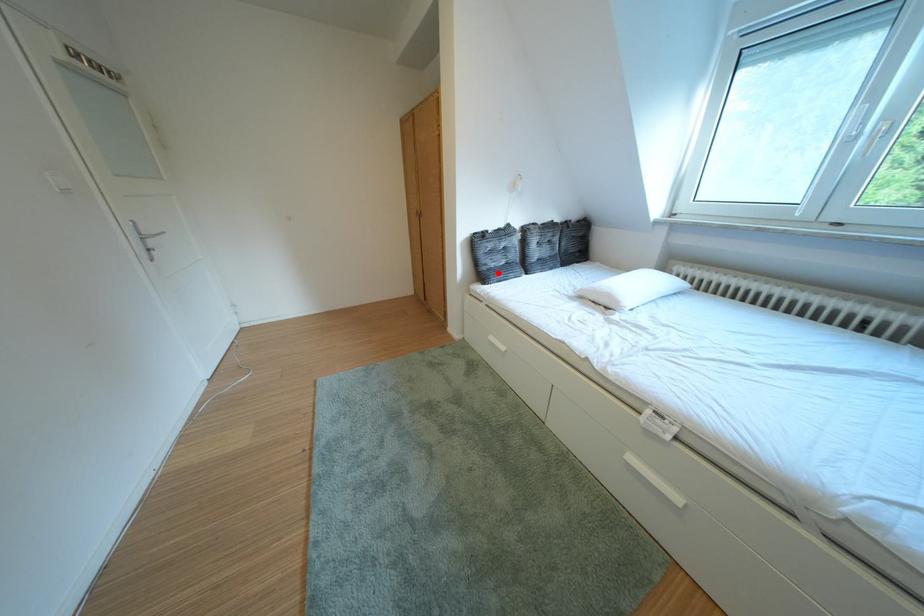
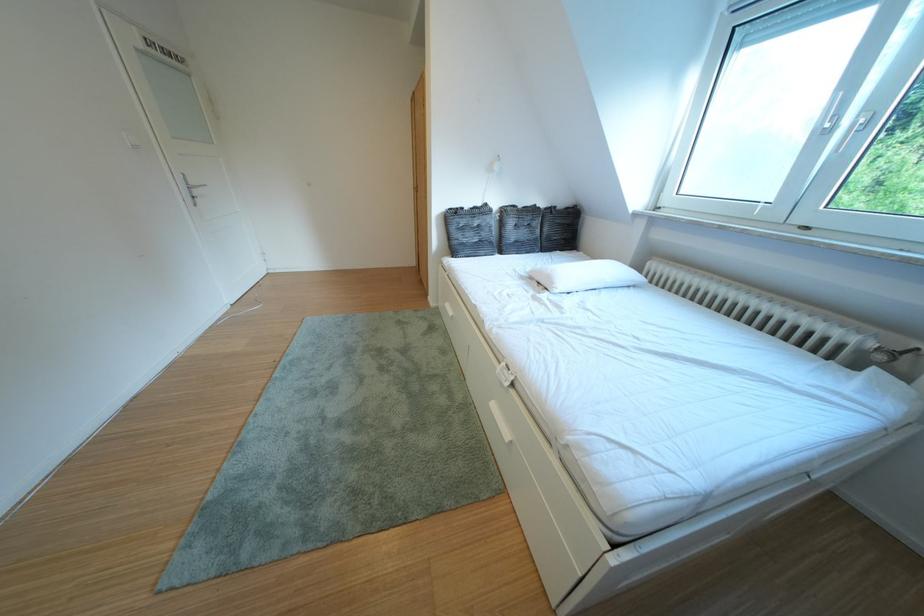
Locate, in the second image, the point that corresponds to the highlighted location in the first image.

(468, 246)